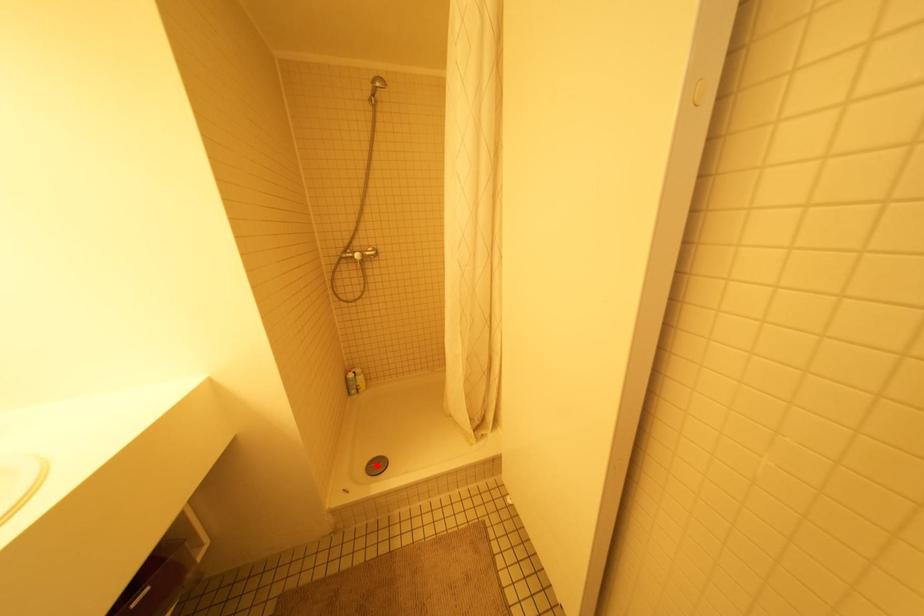
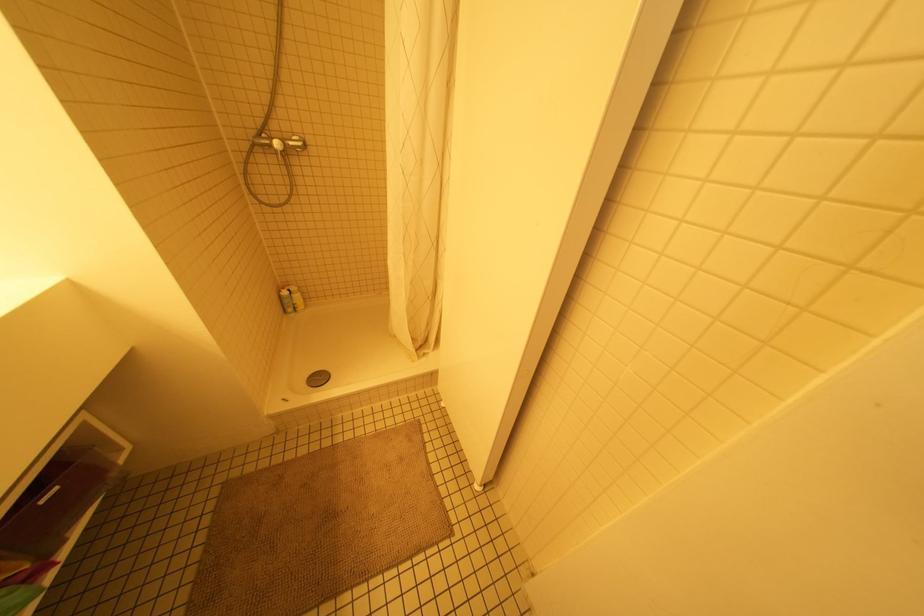
Question: I am providing you with two images of the same scene from different viewpoints. A red point is shown in image1. For the corresponding object point in image2, is it positioned nearer or farther from the camera?

Choices:
 (A) Nearer
 (B) Farther

Answer: (B)